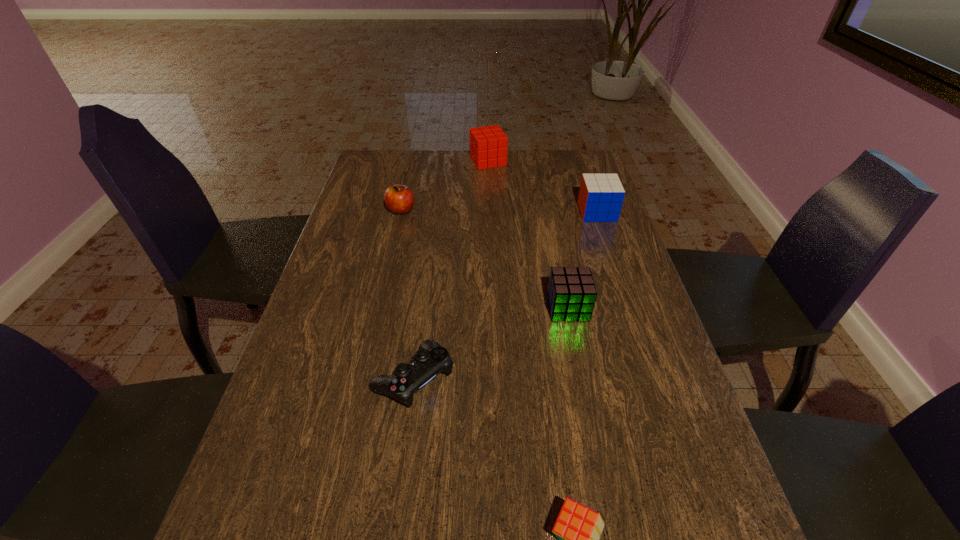
This screenshot has width=960, height=540. I want to click on free spot located 0.330m on the right of the apple, so click(x=519, y=210).

Find the location of a particular element. This screenshot has width=960, height=540. free space located 0.180m on the front of the control is located at coordinates (396, 510).

Image resolution: width=960 pixels, height=540 pixels. Identify the location of object at the far edge. (488, 145).

Locate an element on the screen. object that is positioned at the left edge is located at coordinates (399, 199).

Image resolution: width=960 pixels, height=540 pixels. In the image, there is a desktop. Identify the location of vacant space at the left edge. (357, 303).

This screenshot has height=540, width=960. In the image, there is a desktop. In order to click on vacant area at the right edge in this screenshot , I will do `click(681, 424)`.

This screenshot has height=540, width=960. I want to click on vacant space at the far right corner of the desktop, so click(x=574, y=174).

Identify the location of free space that is in between the rightmost cube and the apple. (499, 211).

The height and width of the screenshot is (540, 960). I want to click on empty location between the second nearest object and the third object from left to right, so click(451, 269).

I want to click on free space that is in between the second nearest object and the leftmost cube, so click(x=451, y=269).